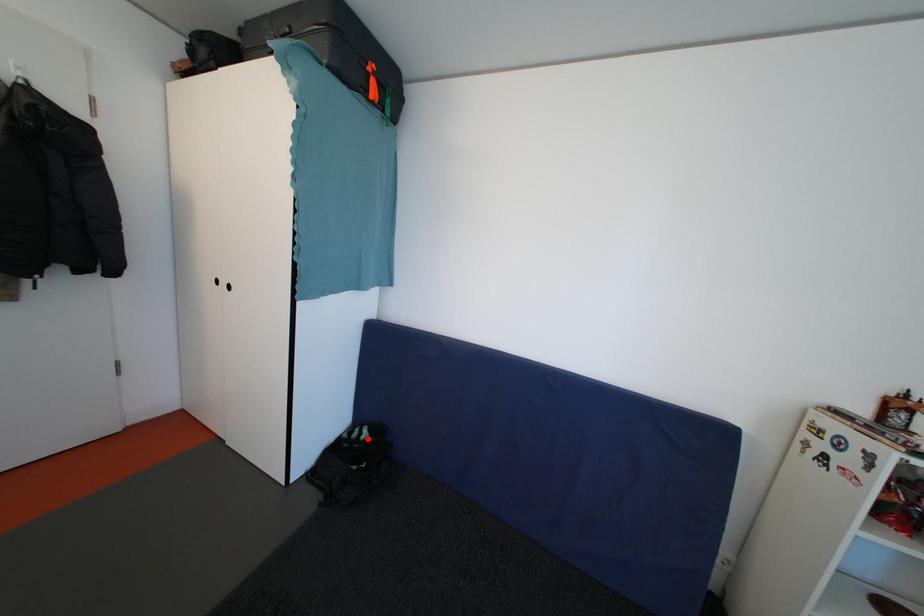
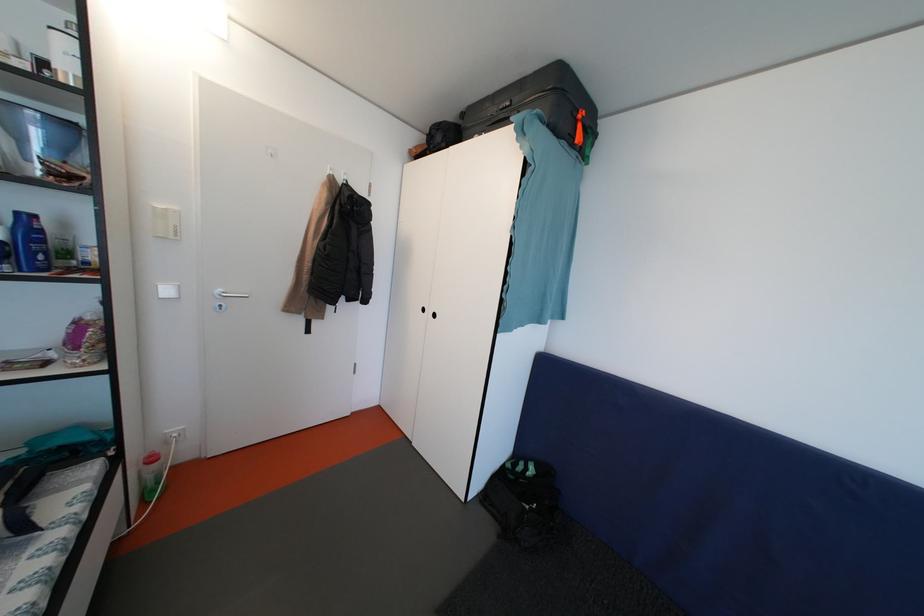
Question: I am providing you with two images of the same scene from different viewpoints. Image1 has a red point marked. In image2, the corresponding 3D location appears at what relative position? Reply with the corresponding letter.

Choices:
 (A) Closer
 (B) Farther

Answer: (A)